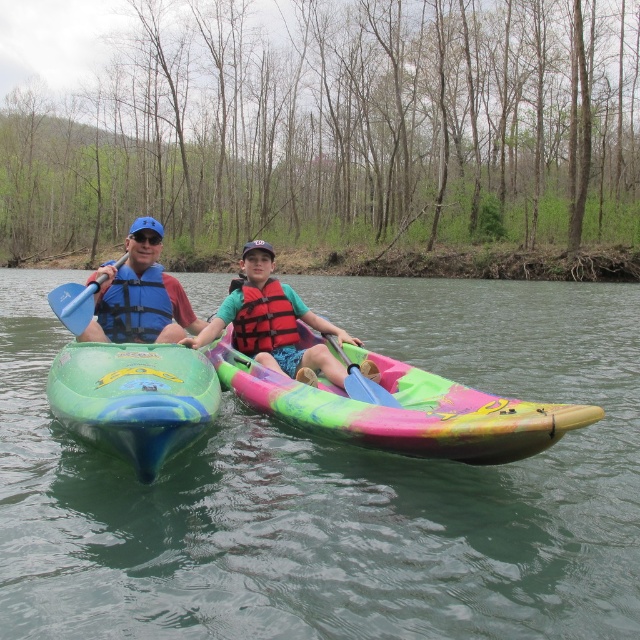
Does red life vest at center appear on the left side of blue fabric life vest at left?

No, red life vest at center is not to the left of blue fabric life vest at left.

Describe the element at coordinates (273, 323) in the screenshot. I see `red life vest at center` at that location.

You are a GUI agent. You are given a task and a screenshot of the screen. Output one action in this format:
    pyautogui.click(x=<x>, y=<y>)
    Task: Click on the red life vest at center
    Image resolution: width=640 pixels, height=640 pixels.
    Given the screenshot: What is the action you would take?
    pyautogui.click(x=273, y=323)

Does red life vest at center appear under blue/textured life jacket at left?

Correct, red life vest at center is located below blue/textured life jacket at left.

Is red life vest at center in front of blue/textured life jacket at left?

That is True.

Between point (216, 314) and point (140, 305), which one is positioned in front?

Point (140, 305) is in front.

The image size is (640, 640). I want to click on red life vest at center, so click(x=273, y=323).

Can you confirm if blue/textured life jacket at left is positioned below blue plastic paddle at left?

No.

Measure the distance between point (131, 278) and camera.

A distance of 7.77 meters exists between point (131, 278) and camera.

The image size is (640, 640). Find the location of `blue/textured life jacket at left`. blue/textured life jacket at left is located at coordinates (134, 305).